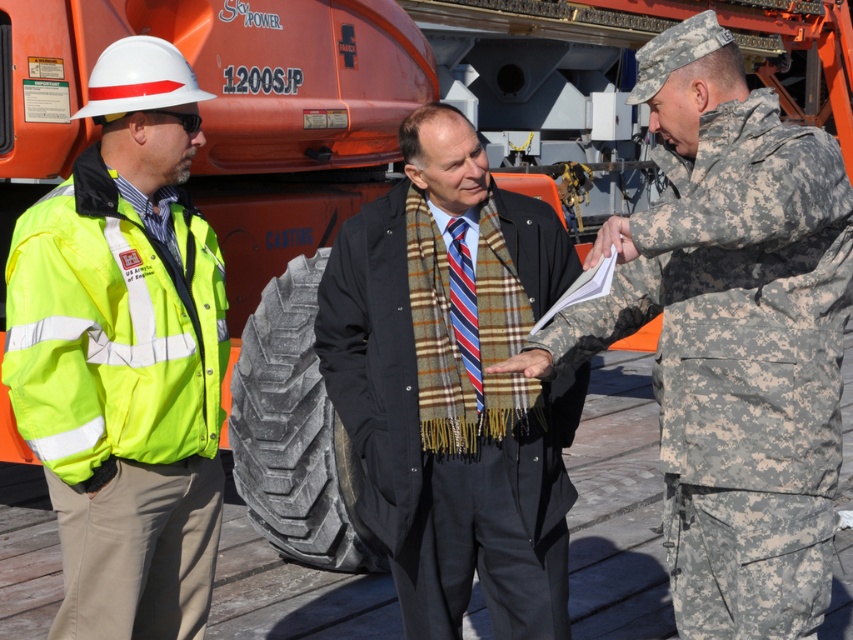
You are standing at the point labeled point (474, 292) and want to walk to the point labeled point (474, 417). Which direction should you face to move towards your destination?

You should face towards the direction of the point labeled point (474, 417) because it is closer to you than point (474, 292).